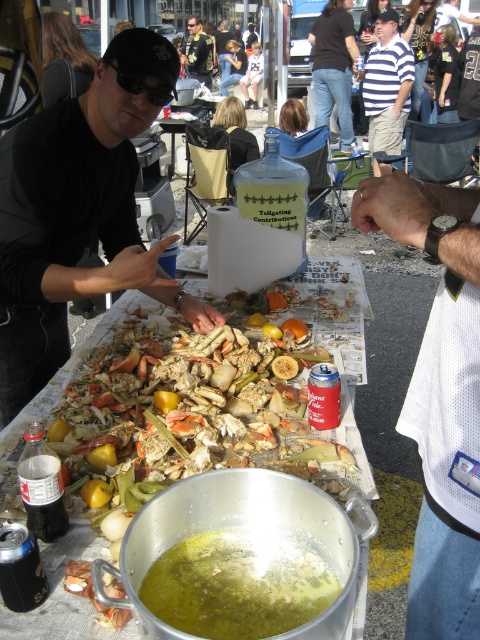
You are organizing a tailgating event and need to decide which attendee is wearing a smaller top. You see the striped cotton shirt at upper center and the shiny gold jacket at center. Which one has a smaller size?

The striped cotton shirt at upper center has a smaller size compared to the shiny gold jacket at center.

You are at a tailgating event and need to place a 12 inch wide plate on the table. The table has a white mesh shirt at center and a green matte soup at center. Which object should you avoid placing the plate near to ensure it doesn

You should avoid placing the plate near the white mesh shirt at center because its width is larger than the green matte soup at center, which means there might be less space around it.